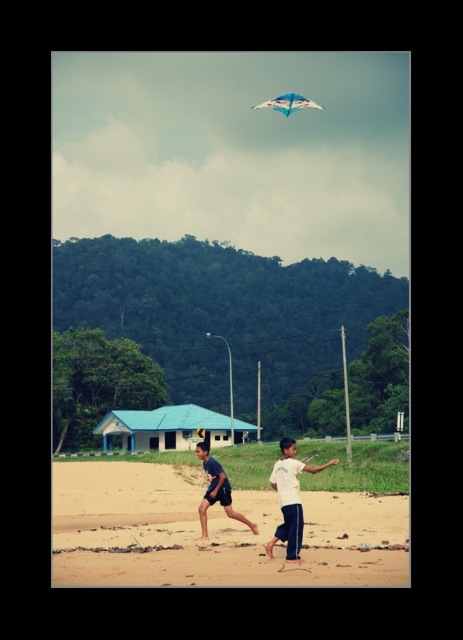
You are standing at the beach and see two points marked on the sand. The first point is at coordinate point (205, 512) and the second is at point (293, 100). Which point is closer to you?

Point (205, 512) is closer to the viewer than point (293, 100).

Based on the photo, you are a photographer trying to capture a photo of the dark blue fabric shorts at center and the translucent blue kite at upper center. Based on their positions, which object is closer to the camera?

The dark blue fabric shorts at center is closer to the camera because it is positioned below the translucent blue kite at upper center, indicating it is in a lower plane relative to the camera view.